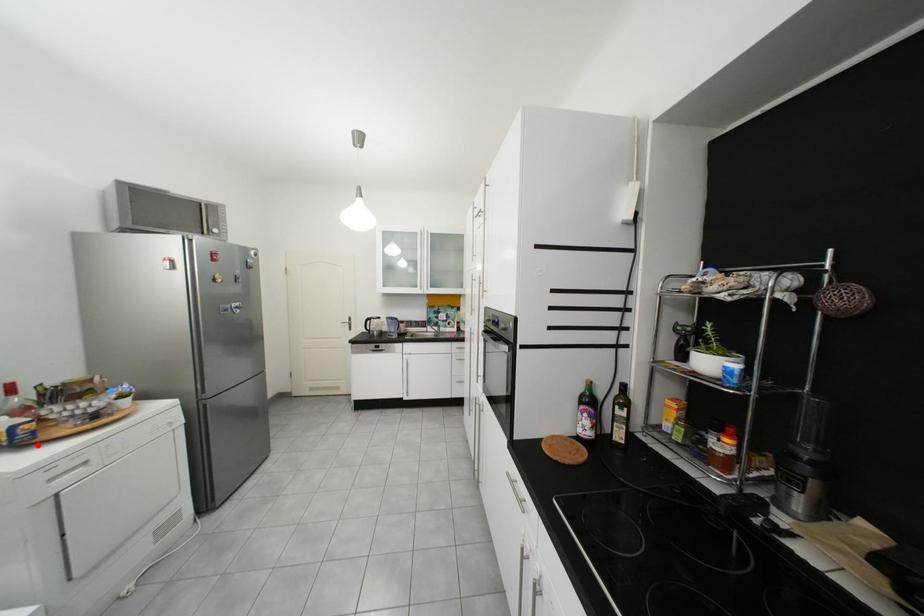
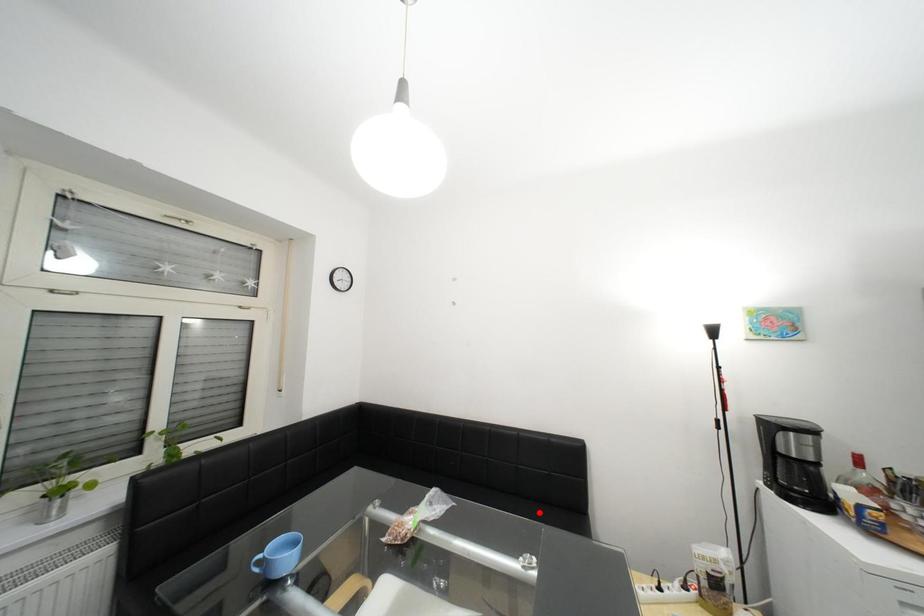
I am providing you with two images of the same scene from different viewpoints. A red point is marked on the first image and another point is marked on the second image. Are the points marked in image1 and image2 representing the same 3D position?

No